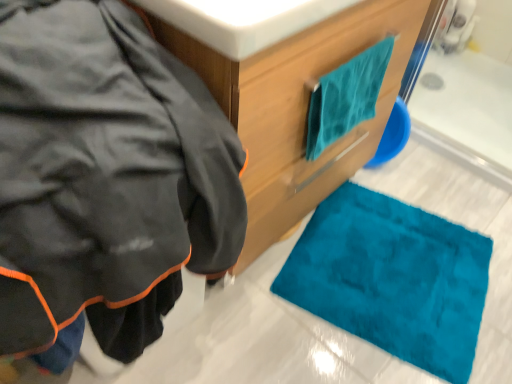
Question: Is white glossy sink at upper center further to the viewer compared to matte black jacket at left?

Choices:
 (A) no
 (B) yes

Answer: (B)

Question: Is the position of white glossy sink at upper center less distant than that of matte black jacket at left?

Choices:
 (A) no
 (B) yes

Answer: (A)

Question: Can you confirm if white glossy sink at upper center is shorter than matte black jacket at left?

Choices:
 (A) yes
 (B) no

Answer: (A)

Question: Is matte black jacket at left inside white glossy sink at upper center?

Choices:
 (A) no
 (B) yes

Answer: (A)

Question: Would you say white glossy sink at upper center is outside matte black jacket at left?

Choices:
 (A) no
 (B) yes

Answer: (B)

Question: Which is correct: white glossy sink at upper center is inside teal fabric towel at upper right, or outside of it?

Choices:
 (A) inside
 (B) outside

Answer: (B)

Question: Relative to teal fabric towel at upper right, is white glossy sink at upper center in front or behind?

Choices:
 (A) behind
 (B) front

Answer: (B)

Question: Based on their sizes in the image, would you say white glossy sink at upper center is bigger or smaller than teal fabric towel at upper right?

Choices:
 (A) small
 (B) big

Answer: (A)

Question: Is white glossy sink at upper center taller or shorter than teal fabric towel at upper right?

Choices:
 (A) short
 (B) tall

Answer: (A)

Question: Considering the positions of white glossy sink at upper center and teal soft towel at upper right in the image, is white glossy sink at upper center wider or thinner than teal soft towel at upper right?

Choices:
 (A) wide
 (B) thin

Answer: (A)

Question: Is point (247, 14) positioned closer to the camera than point (343, 76)?

Choices:
 (A) farther
 (B) closer

Answer: (B)

Question: Visually, is white glossy sink at upper center positioned to the left or to the right of teal soft towel at upper right?

Choices:
 (A) right
 (B) left

Answer: (B)

Question: In terms of size, does white glossy sink at upper center appear bigger or smaller than teal soft towel at upper right?

Choices:
 (A) small
 (B) big

Answer: (B)

Question: From a real-world perspective, is matte black jacket at left physically located above or below white glossy sink at upper center?

Choices:
 (A) below
 (B) above

Answer: (A)

Question: Considering the positions of point (118, 145) and point (336, 1), is point (118, 145) closer or farther from the camera than point (336, 1)?

Choices:
 (A) closer
 (B) farther

Answer: (A)